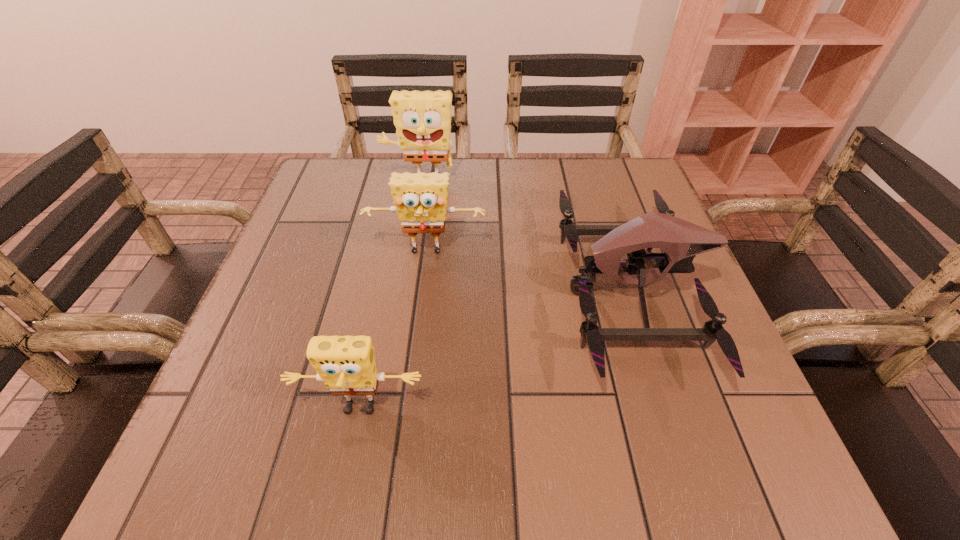
Where is `free space between the tallest sponge and the nearest sponge`? free space between the tallest sponge and the nearest sponge is located at coordinates (390, 295).

Image resolution: width=960 pixels, height=540 pixels. Find the location of `unoccupied position between the nearest sponge and the second farthest sponge`. unoccupied position between the nearest sponge and the second farthest sponge is located at coordinates (393, 331).

Where is `vacant space in between the drone and the nearest sponge`? This screenshot has width=960, height=540. vacant space in between the drone and the nearest sponge is located at coordinates (495, 350).

This screenshot has height=540, width=960. I want to click on vacant space that is in between the nearest sponge and the second farthest sponge, so click(x=393, y=331).

The image size is (960, 540). I want to click on empty space that is in between the nearest sponge and the second nearest sponge, so pos(393,331).

Identify the location of free spot between the tallest object and the nearest sponge. Image resolution: width=960 pixels, height=540 pixels. (390, 295).

Identify which object is the third closest to the second farthest sponge. Please provide its 2D coordinates. Your answer should be formatted as a tuple, i.e. [(x, y)], where the tuple contains the x and y coordinates of a point satisfying the conditions above.

[(346, 364)]

Identify the location of the closest object to the farthest sponge. (420, 199).

Identify which sponge is located as the nearest to the nearest sponge. Please provide its 2D coordinates. Your answer should be formatted as a tuple, i.e. [(x, y)], where the tuple contains the x and y coordinates of a point satisfying the conditions above.

[(420, 199)]

Where is `sponge identified as the closest to the farthest object`? This screenshot has width=960, height=540. sponge identified as the closest to the farthest object is located at coordinates (420, 199).